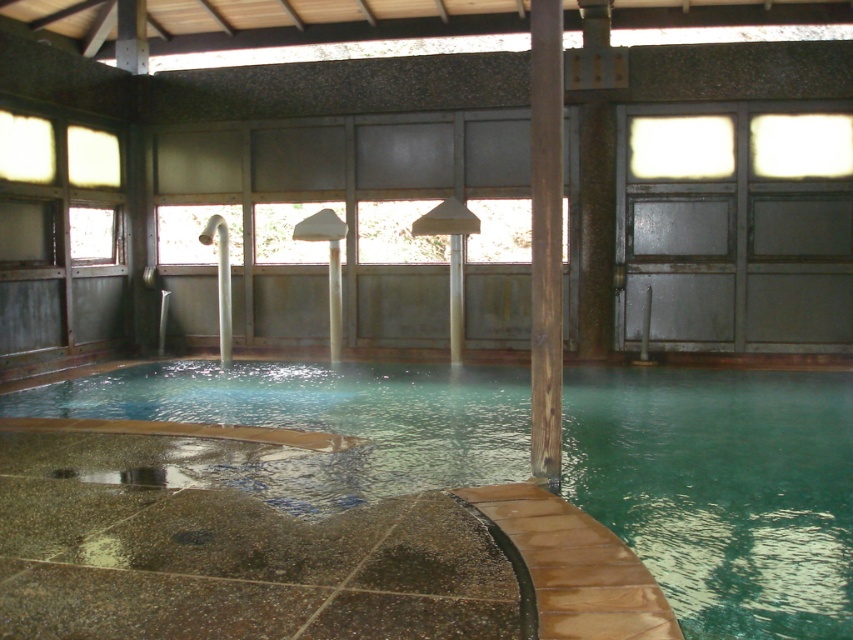
Who is positioned more to the right, green polished stone swimming pool at center or brown wood pillar at center?

brown wood pillar at center

Which is in front, point (676, 497) or point (553, 257)?

Positioned in front is point (676, 497).

Locate an element on the screen. The image size is (853, 640). green polished stone swimming pool at center is located at coordinates (723, 490).